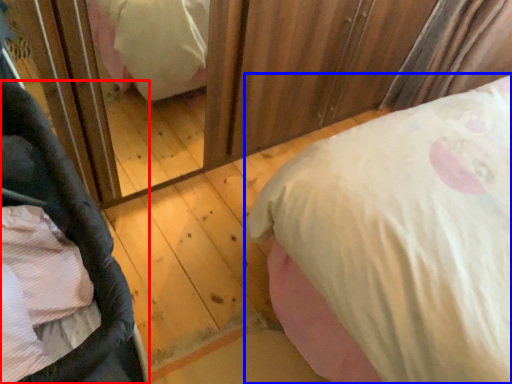
Question: Which object is further to the camera taking this photo, baby carriage (highlighted by a red box) or bed (highlighted by a blue box)?

Choices:
 (A) baby carriage
 (B) bed

Answer: (B)